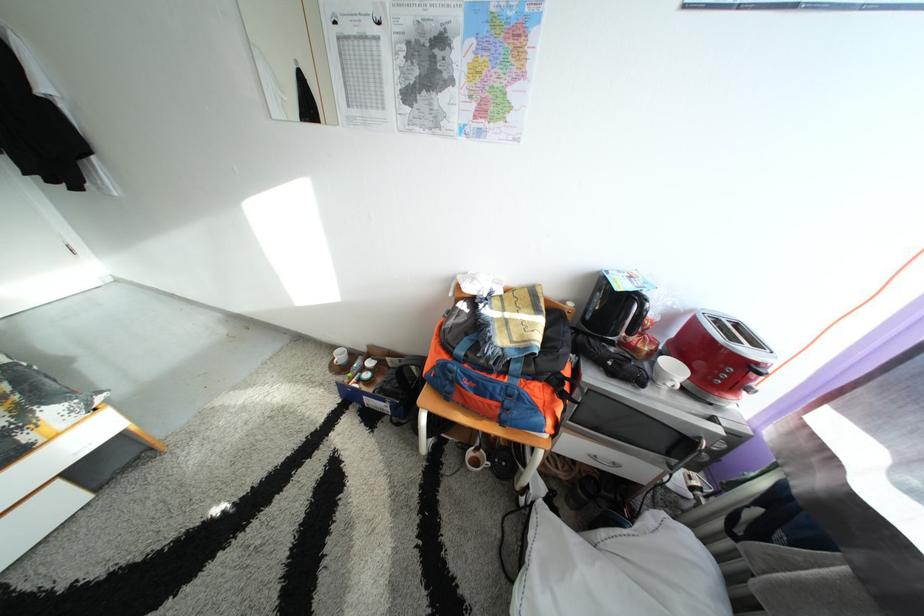
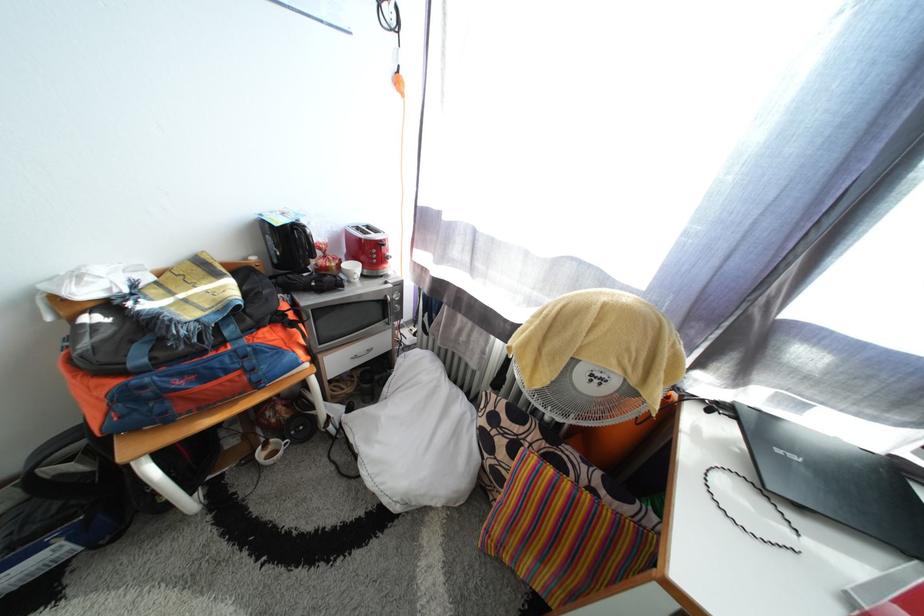
Where in the second image is the point corresponding to [487,461] from the first image?

(280, 455)